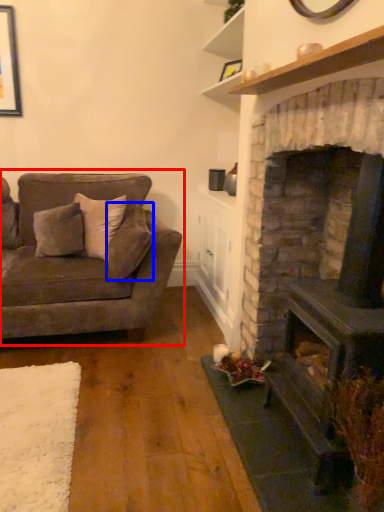
Question: Which point is closer to the camera, studio couch (highlighted by a red box) or pillow (highlighted by a blue box)?

Choices:
 (A) studio couch
 (B) pillow

Answer: (A)